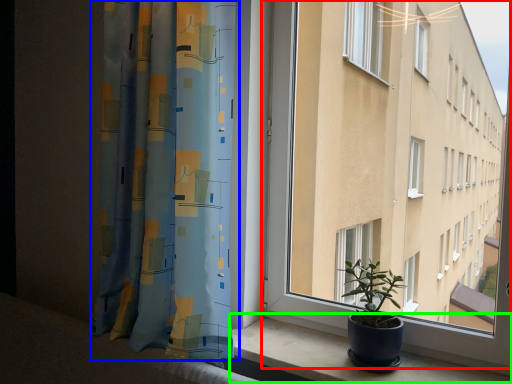
Question: Which is farther away from window (highlighted by a red box)? curtain (highlighted by a blue box) or window sill (highlighted by a green box)?

Choices:
 (A) curtain
 (B) window sill

Answer: (A)